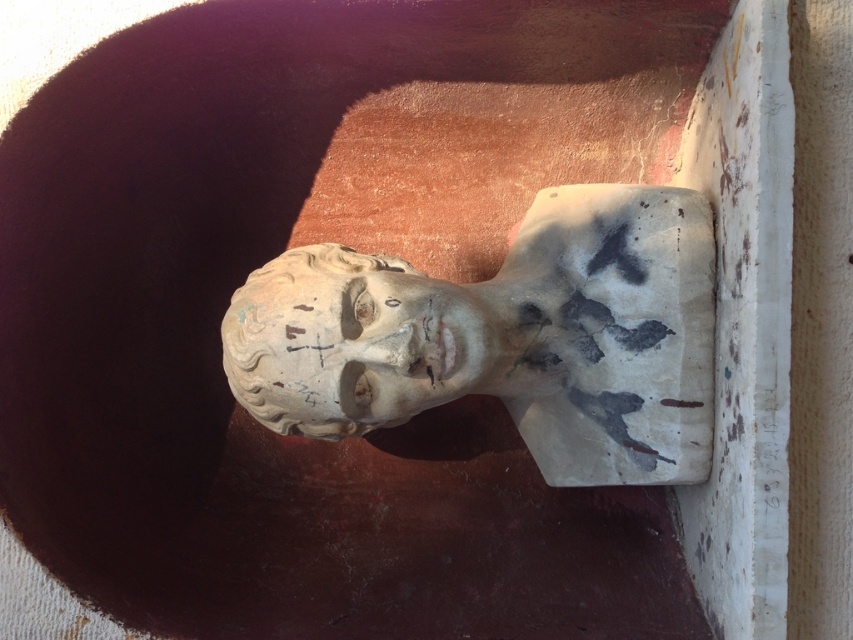
Who is taller, white plaster bust at center or white stone bust at center?

white plaster bust at center is taller.

Is white plaster bust at center smaller than white stone bust at center?

Incorrect, white plaster bust at center is not smaller in size than white stone bust at center.

What do you see at coordinates (505, 337) in the screenshot?
I see `white plaster bust at center` at bounding box center [505, 337].

In order to click on white plaster bust at center in this screenshot , I will do `click(505, 337)`.